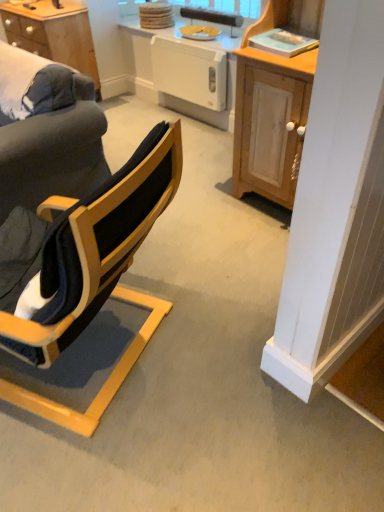
Question: Does wooden desk at upper left have a greater height compared to white glossy radiator at center?

Choices:
 (A) no
 (B) yes

Answer: (A)

Question: Does wooden desk at upper left come behind white glossy radiator at center?

Choices:
 (A) no
 (B) yes

Answer: (B)

Question: Can you confirm if wooden desk at upper left is smaller than white glossy radiator at center?

Choices:
 (A) no
 (B) yes

Answer: (A)

Question: Does wooden desk at upper left have a larger size compared to white glossy radiator at center?

Choices:
 (A) no
 (B) yes

Answer: (B)

Question: From a real-world perspective, is wooden desk at upper left on top of white glossy radiator at center?

Choices:
 (A) yes
 (B) no

Answer: (B)

Question: From a real-world perspective, is yellow matte plate at upper center above or below white glossy radiator at center?

Choices:
 (A) below
 (B) above

Answer: (B)

Question: Considering the positions of yellow matte plate at upper center and white glossy radiator at center in the image, is yellow matte plate at upper center wider or thinner than white glossy radiator at center?

Choices:
 (A) wide
 (B) thin

Answer: (A)

Question: Is point tap(183, 33) positioned closer to the camera than point tap(228, 40)?

Choices:
 (A) farther
 (B) closer

Answer: (A)

Question: Considering the relative positions of yellow matte plate at upper center and white glossy radiator at center in the image provided, is yellow matte plate at upper center to the left or to the right of white glossy radiator at center?

Choices:
 (A) right
 (B) left

Answer: (A)

Question: Is white plastic dishwasher at center taller or shorter than light wood cabinet at right?

Choices:
 (A) tall
 (B) short

Answer: (B)

Question: Is white plastic dishwasher at center bigger or smaller than light wood cabinet at right?

Choices:
 (A) small
 (B) big

Answer: (A)

Question: Is white plastic dishwasher at center inside or outside of light wood cabinet at right?

Choices:
 (A) inside
 (B) outside

Answer: (B)

Question: Considering the relative positions of white plastic dishwasher at center and light wood cabinet at right in the image provided, is white plastic dishwasher at center to the left or to the right of light wood cabinet at right?

Choices:
 (A) right
 (B) left

Answer: (B)

Question: Based on their sizes in the image, would you say light wood cabinet at right is bigger or smaller than yellow matte plate at upper center?

Choices:
 (A) small
 (B) big

Answer: (B)

Question: From a real-world perspective, is light wood cabinet at right above or below yellow matte plate at upper center?

Choices:
 (A) above
 (B) below

Answer: (B)